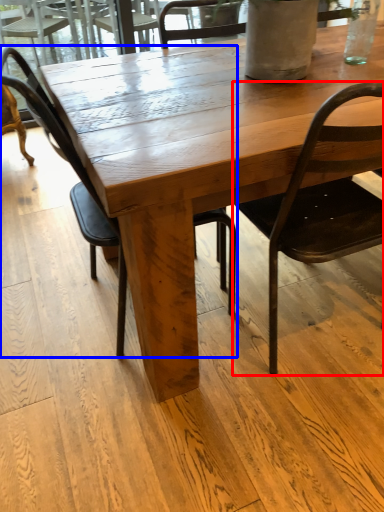
Question: Which of the following is the closest to the observer, chair (highlighted by a red box) or chair (highlighted by a blue box)?

Choices:
 (A) chair
 (B) chair

Answer: (A)